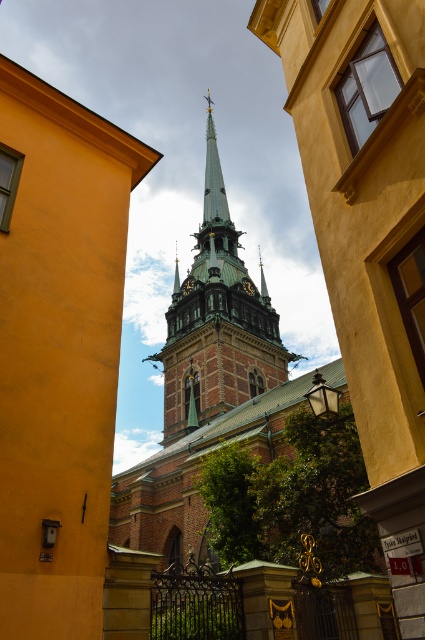
Which is below, brown stone tower at center or green metallic spire at center?

green metallic spire at center is lower down.

Consider the image. Is brown stone tower at center positioned before green metallic spire at center?

Yes, brown stone tower at center is closer to the viewer.

Between point (186, 337) and point (268, 301), which one is positioned behind?

The point (268, 301) is more distant.

I want to click on brown stone tower at center, so click(x=217, y=323).

Which of these two, green stone church steeple at center or green copper spire at center, stands shorter?

green copper spire at center

Who is taller, green stone church steeple at center or green copper spire at center?

With more height is green stone church steeple at center.

Does point (147, 492) come in front of point (175, 282)?

Yes.

I want to click on green stone church steeple at center, so click(206, 388).

Which is above, green copper spire at center or gold metallic clock at center?

green copper spire at center is higher up.

Is point (175, 284) farther from camera compared to point (241, 285)?

Yes, it is behind point (241, 285).

At what (x,y) coordinates should I click in order to perform the action: click on green copper spire at center. Please return your answer as a coordinate pair (x, y). Image resolution: width=425 pixels, height=640 pixels. Looking at the image, I should click on (175, 273).